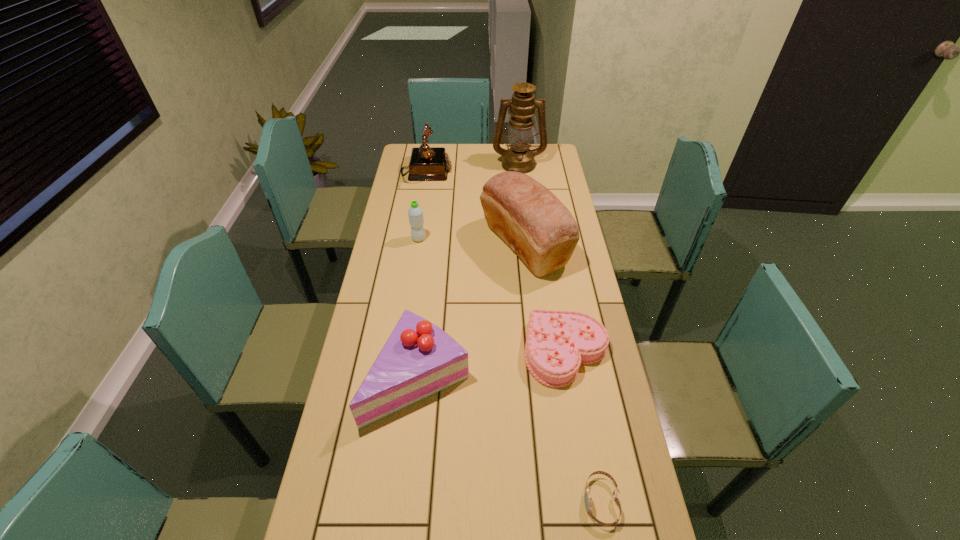
Identify the location of free space located on the front of the sixth shortest object. (538, 377).

Locate an element on the screen. This screenshot has width=960, height=540. blank space located on the dial of the telephone is located at coordinates (533, 173).

Image resolution: width=960 pixels, height=540 pixels. In order to click on vacant space located on the right of the water bottle in this screenshot , I will do `click(525, 239)`.

The height and width of the screenshot is (540, 960). What are the coordinates of `vacant space located on the front of the taller cake` in the screenshot? It's located at (409, 463).

Where is `vacant space located 0.120m on the front of the shorter cake`? vacant space located 0.120m on the front of the shorter cake is located at coordinates (579, 429).

Where is `free region located 0.330m on the face of the watch`? free region located 0.330m on the face of the watch is located at coordinates (445, 501).

Find the location of `vacant area located 0.050m on the face of the watch`. vacant area located 0.050m on the face of the watch is located at coordinates (563, 501).

I want to click on free location located 0.090m on the face of the watch, so click(x=546, y=501).

Where is `oil lamp that is at the far edge`? oil lamp that is at the far edge is located at coordinates [x=519, y=158].

Locate an element on the screen. telephone that is at the far edge is located at coordinates (426, 163).